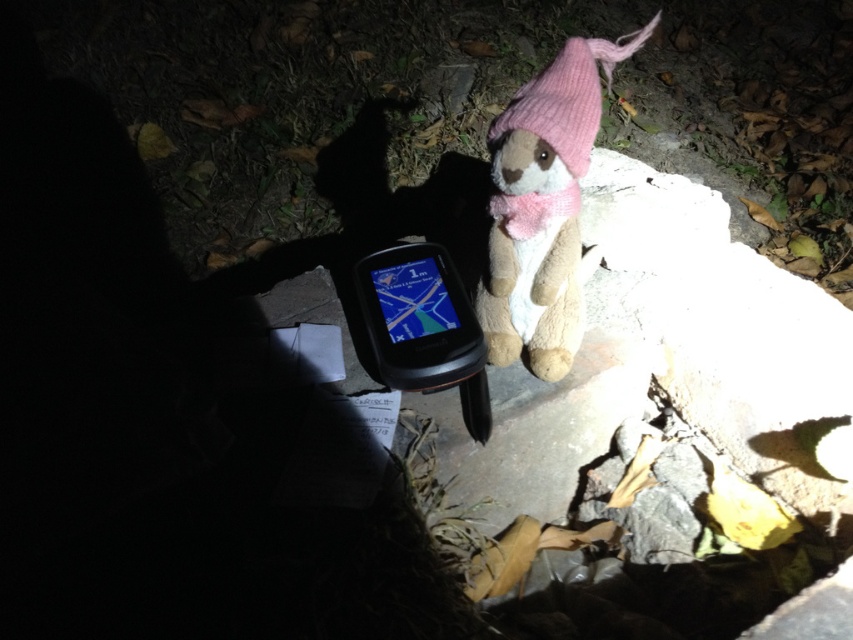
Who is lower down, soft pink knit hat at upper right or pink knitted hat at upper right?

soft pink knit hat at upper right is lower down.

Is soft pink knit hat at upper right further to camera compared to pink knitted hat at upper right?

That is False.

I want to click on soft pink knit hat at upper right, so click(543, 205).

The image size is (853, 640). I want to click on soft pink knit hat at upper right, so click(x=543, y=205).

Does black plastic phone at center appear on the right side of pink knitted hat at upper right?

In fact, black plastic phone at center is to the left of pink knitted hat at upper right.

Does black plastic phone at center have a greater width compared to pink knitted hat at upper right?

In fact, black plastic phone at center might be narrower than pink knitted hat at upper right.

Which is behind, point (374, 358) or point (596, 76)?

Positioned behind is point (374, 358).

At what (x,y) coordinates should I click in order to perform the action: click on black plastic phone at center. Please return your answer as a coordinate pair (x, y). This screenshot has width=853, height=640. Looking at the image, I should click on (419, 320).

Is soft pink knit hat at upper right to the left of black plastic phone at center from the viewer's perspective?

Incorrect, soft pink knit hat at upper right is not on the left side of black plastic phone at center.

Between point (595, 51) and point (456, 294), which one is positioned in front?

Positioned in front is point (595, 51).

You are a GUI agent. You are given a task and a screenshot of the screen. Output one action in this format:
    pyautogui.click(x=<x>, y=<y>)
    Task: Click on the soft pink knit hat at upper right
    
    Given the screenshot: What is the action you would take?
    pyautogui.click(x=543, y=205)